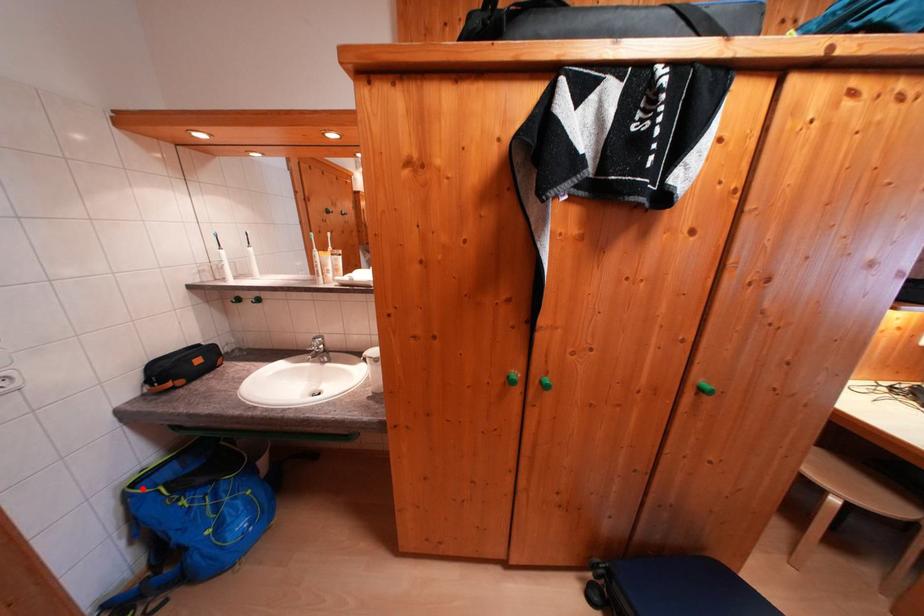
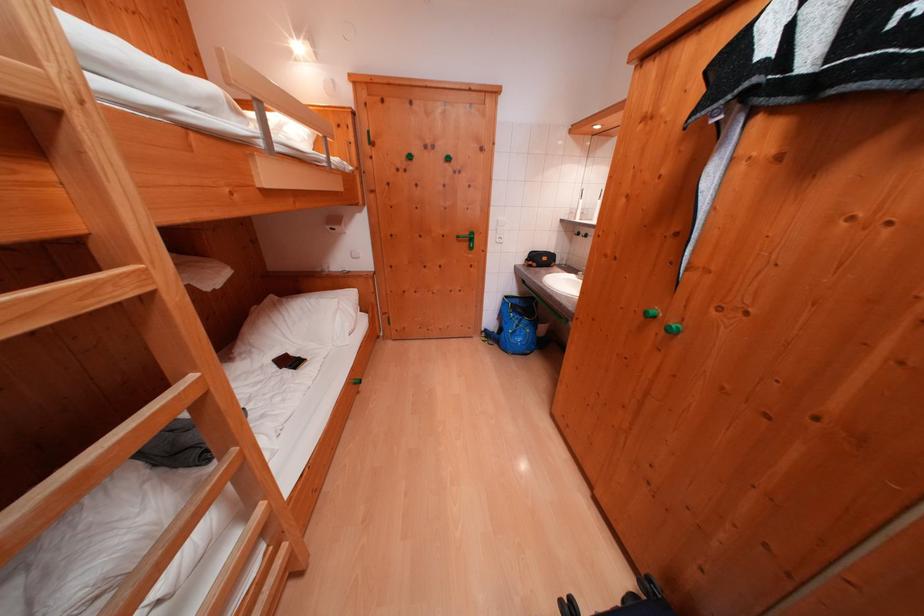
Where in the second image is the point corresponding to the highlighted location from the first image?

(515, 301)